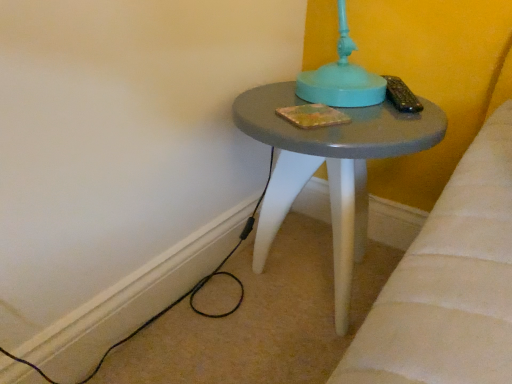
Question: Is black wire at lower left wider or thinner than matte gray stool at center?

Choices:
 (A) wide
 (B) thin

Answer: (B)

Question: Choose the correct answer: Is black wire at lower left inside matte gray stool at center or outside it?

Choices:
 (A) inside
 (B) outside

Answer: (B)

Question: In terms of height, does black wire at lower left look taller or shorter compared to matte gray stool at center?

Choices:
 (A) short
 (B) tall

Answer: (A)

Question: Looking at the image, does matte gray stool at center seem bigger or smaller compared to black wire at lower left?

Choices:
 (A) small
 (B) big

Answer: (B)

Question: From a real-world perspective, is matte gray stool at center physically located above or below black wire at lower left?

Choices:
 (A) below
 (B) above

Answer: (B)

Question: Is matte gray stool at center taller or shorter than black wire at lower left?

Choices:
 (A) tall
 (B) short

Answer: (A)

Question: Is matte gray stool at center to the left or to the right of black wire at lower left in the image?

Choices:
 (A) right
 (B) left

Answer: (A)